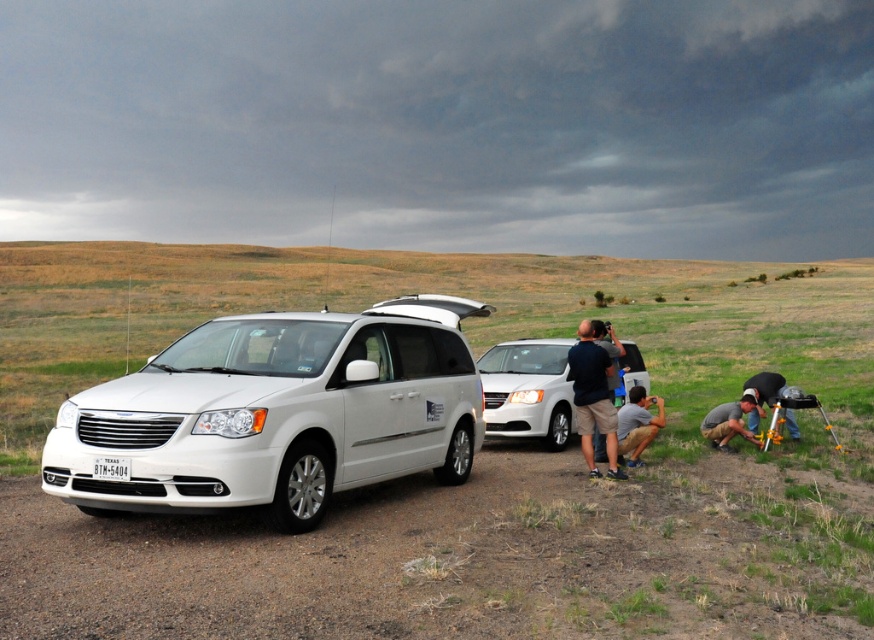
You are a photographer trying to set up your equipment in the rural outdoor scene. You have a green grass at lower right and a metallic silver tripod at lower right. Which object occupies more space in the scene?

The green grass at lower right has a larger size compared to the metallic silver tripod at lower right, so the green grass at lower right occupies more space in the scene.

What are the coordinates of the dirt track at lower left?

The dirt track at lower left is located at coordinates point [477,554].

You are a photographer setting up equipment in the rural scene. You need to choose a surface for your tripod between the dirt track at lower left and the green grass at lower right. Which surface has a larger area to place your equipment?

The green grass at lower right has a larger area than the dirt track at lower left, so it is better to place the tripod there.